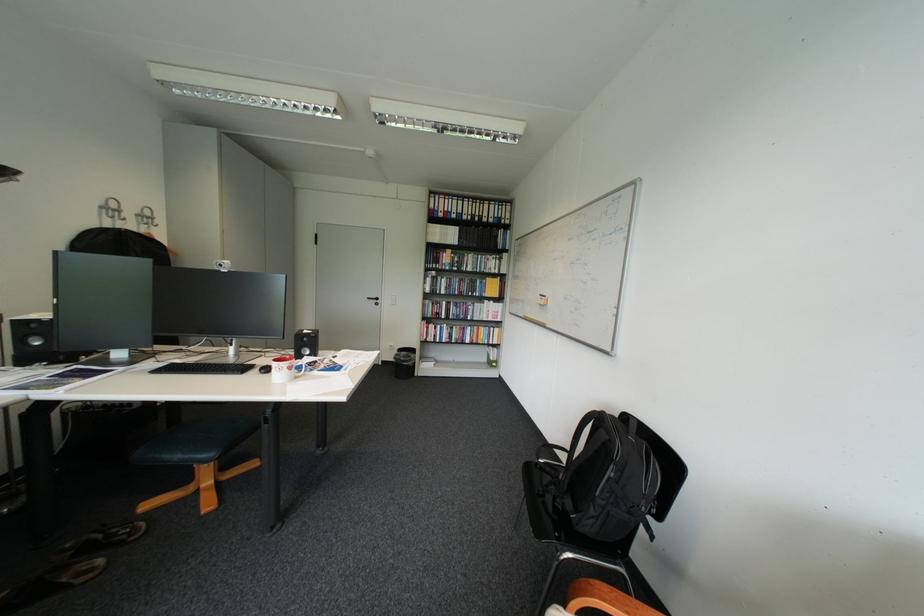
Where would you turn the black door handle? Please return your answer as a coordinate pair (x, y).

(375, 301)